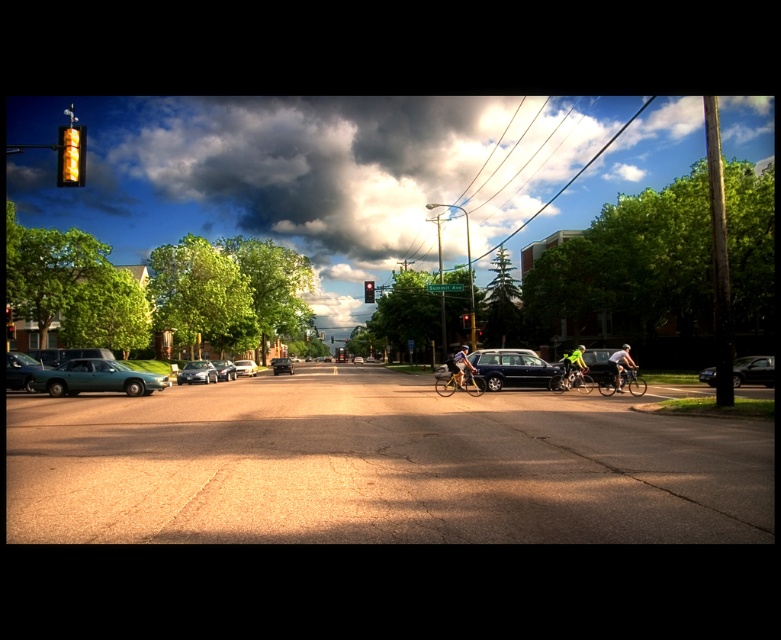
You are a delivery person who needs to choose between the shiny silver bicycle at right and the green matte bicycle at center to deliver packages. Which bicycle is bigger and better suited for carrying heavy loads?

The green matte bicycle at center is bigger than the shiny silver bicycle at right, so it is better suited for carrying heavy loads.

You are standing at the point with coordinates point [601,358] and want to walk to the point with coordinates point [598,381]. Which direction should you face to walk directly towards your destination?

You should face towards the direction of point [598,381], which is in front of point [601,358].

You are a delivery person who needs to move the shiny metallic bicycle at center to the left side of the matte black car at center. Is the bicycle currently on the correct side of the car?

The matte black car at center is positioned on the right side of the shiny metallic bicycle at center, so the bicycle is currently on the left side of the car. Therefore, the bicycle is already on the correct side of the matte black car at center.